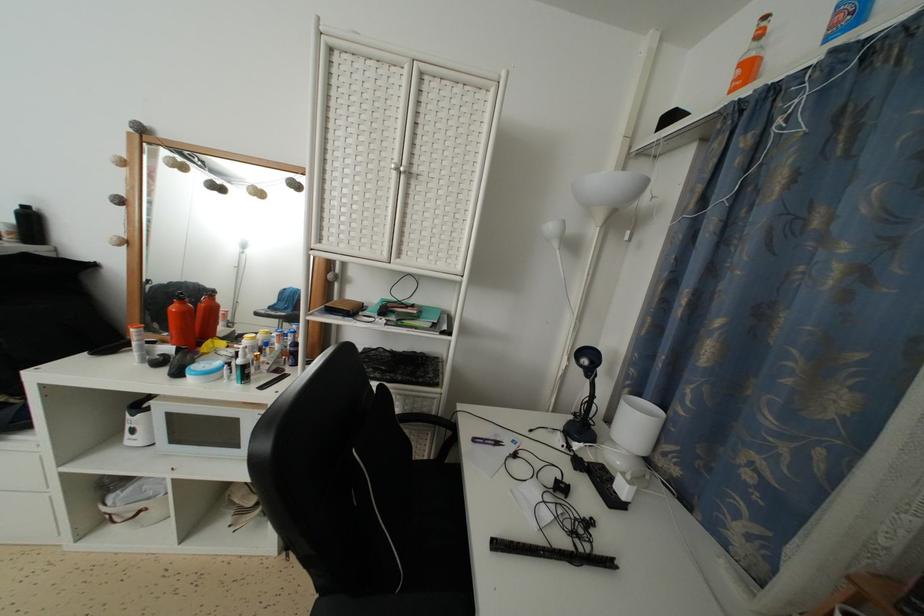
Where would you grasp the purple utility knife? Please return your answer as a coordinate pair (x, y).

(552, 553)